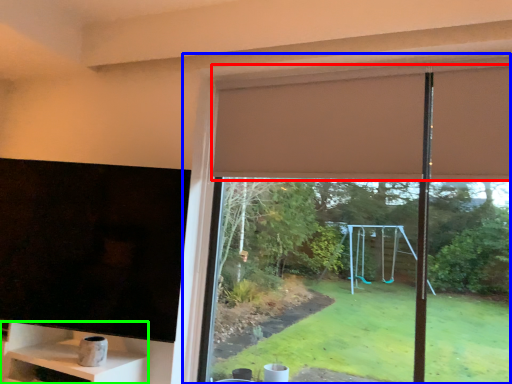
Question: Which is nearer to the curtain (highlighted by a red box)? window (highlighted by a blue box) or shelf (highlighted by a green box).

Choices:
 (A) window
 (B) shelf

Answer: (A)